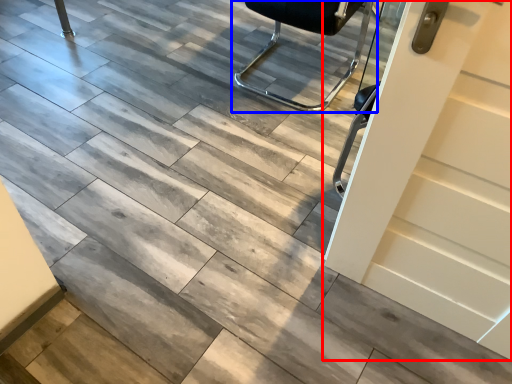
Question: Which of the following is the farthest to the observer, door (highlighted by a red box) or chair (highlighted by a blue box)?

Choices:
 (A) door
 (B) chair

Answer: (B)